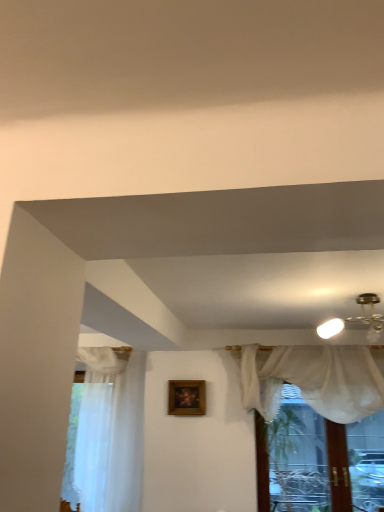
Question: In terms of size, does sheer white curtain at upper center appear bigger or smaller than wooden frame at center?

Choices:
 (A) small
 (B) big

Answer: (B)

Question: Relative to wooden frame at center, is sheer white curtain at upper center in front or behind?

Choices:
 (A) behind
 (B) front

Answer: (B)

Question: Estimate the real-world distances between objects in this image. Which object is closer to the sheer white curtain at left?

Choices:
 (A) wooden frame at center
 (B) sheer white curtain at upper center

Answer: (A)

Question: Which of these objects is positioned farthest from the sheer white curtain at upper center?

Choices:
 (A) sheer white curtain at left
 (B) wooden frame at center

Answer: (A)